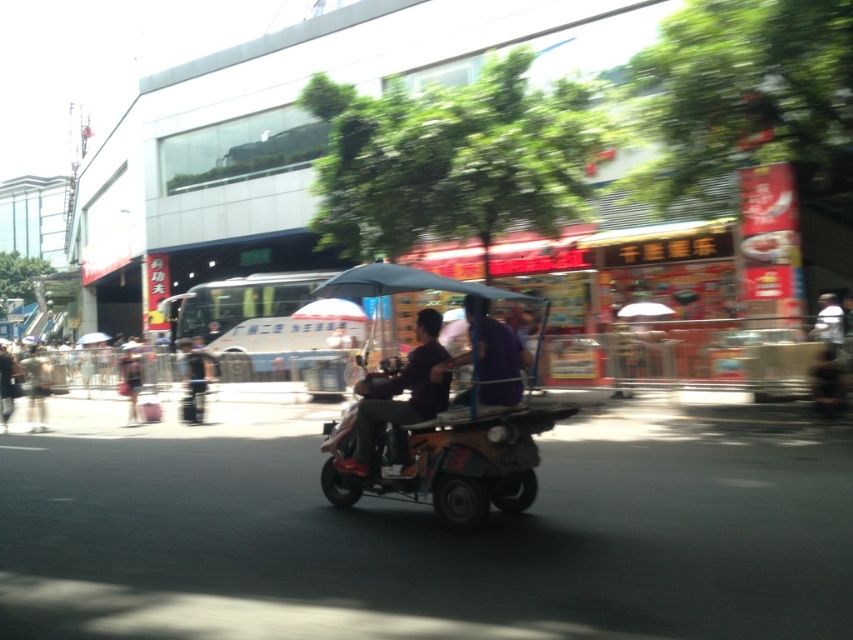
Question: Among these points, which one is nearest to the camera?

Choices:
 (A) (137, 378)
 (B) (413, 378)
 (C) (381, 292)
 (D) (48, 385)

Answer: (B)

Question: Which point is closer to the camera taking this photo?

Choices:
 (A) (397, 413)
 (B) (193, 396)

Answer: (A)

Question: Is purple matte shirt at center below black fabric suitcase at left?

Choices:
 (A) no
 (B) yes

Answer: (A)

Question: Estimate the real-world distances between objects in this image. Which object is closer to the purple matte shirt at center?

Choices:
 (A) matte black umbrella at center
 (B) dark purple shirt at center

Answer: (B)

Question: Is dark gray pants at left smaller than dark gray fabric umbrella at center?

Choices:
 (A) yes
 (B) no

Answer: (B)

Question: Does dark purple shirt at center have a greater width compared to black fabric suitcase at left?

Choices:
 (A) no
 (B) yes

Answer: (B)